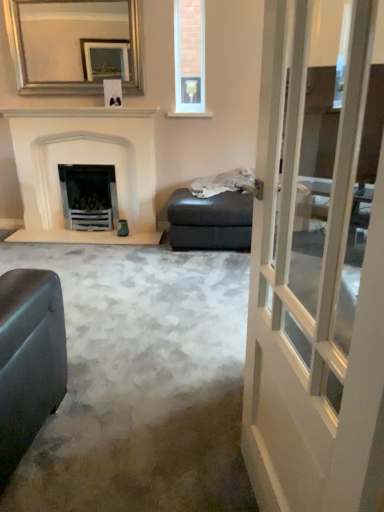
Question: From a real-world perspective, is silver metallic mirror at upper center physically located above or below clear glass wine glass at upper center?

Choices:
 (A) below
 (B) above

Answer: (B)

Question: Is silver metallic mirror at upper center situated inside clear glass wine glass at upper center or outside?

Choices:
 (A) inside
 (B) outside

Answer: (B)

Question: Which of these objects is positioned closest to the white glass door at center?

Choices:
 (A) white marble fireplace at left
 (B) clear glass wine glass at upper center
 (C) silver metallic mirror at upper center
 (D) matte gray footrest at center

Answer: (D)

Question: Which of these objects is positioned farthest from the white glass door at center?

Choices:
 (A) clear glass wine glass at upper center
 (B) matte gray footrest at center
 (C) white marble fireplace at left
 (D) silver metallic mirror at upper center

Answer: (D)